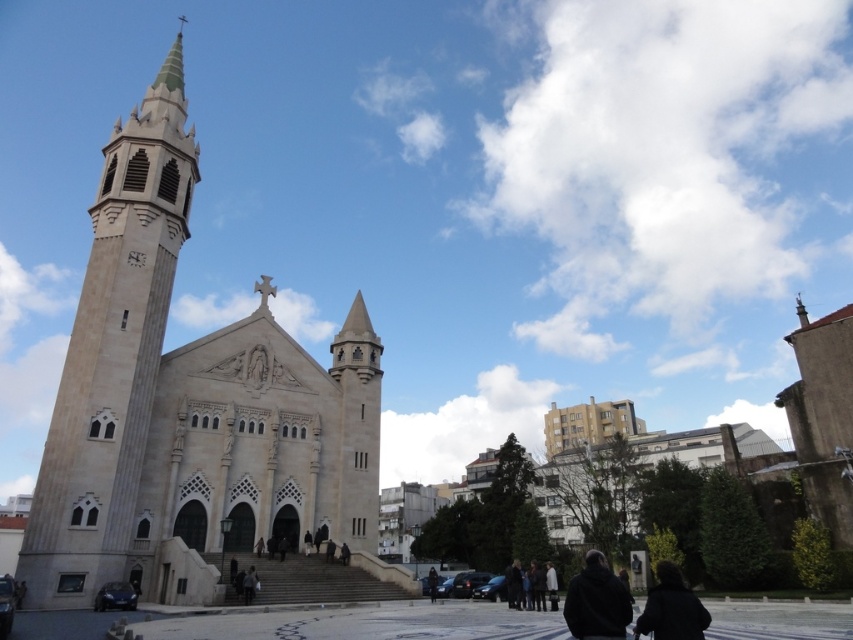
Question: Does black matte jacket at lower right have a smaller size compared to black matte jacket at lower center?

Choices:
 (A) yes
 (B) no

Answer: (B)

Question: Among these objects, which one is farthest from the camera?

Choices:
 (A) light beige stone tower at left
 (B) black matte jacket at lower right
 (C) black matte jacket at lower center

Answer: (A)

Question: Considering the real-world distances, which object is farthest from the beige stone church at left?

Choices:
 (A) light beige stone tower at left
 (B) black matte jacket at lower center
 (C) black matte jacket at lower right

Answer: (B)

Question: Which point is farther from the camera taking this photo?

Choices:
 (A) (662, 611)
 (B) (585, 561)
 (C) (283, 492)

Answer: (B)

Question: From the image, what is the correct spatial relationship of beige stone church at left in relation to light beige stone tower at left?

Choices:
 (A) right
 (B) left

Answer: (A)

Question: From the image, what is the correct spatial relationship of beige stone church at left in relation to light beige stone tower at left?

Choices:
 (A) below
 (B) above

Answer: (A)